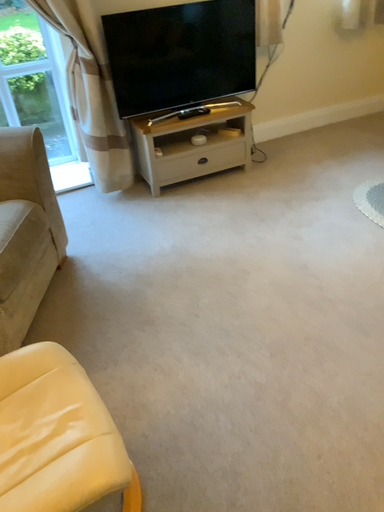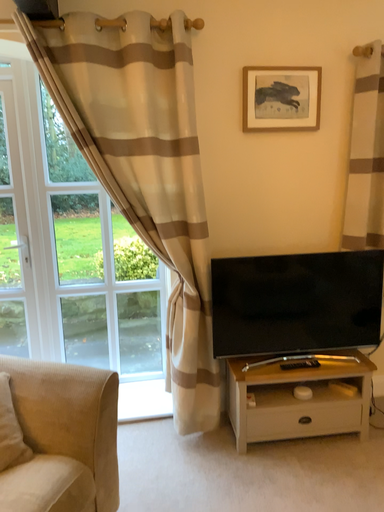
Question: Which way did the camera rotate in the video?

Choices:
 (A) rotated downward
 (B) rotated upward

Answer: (B)